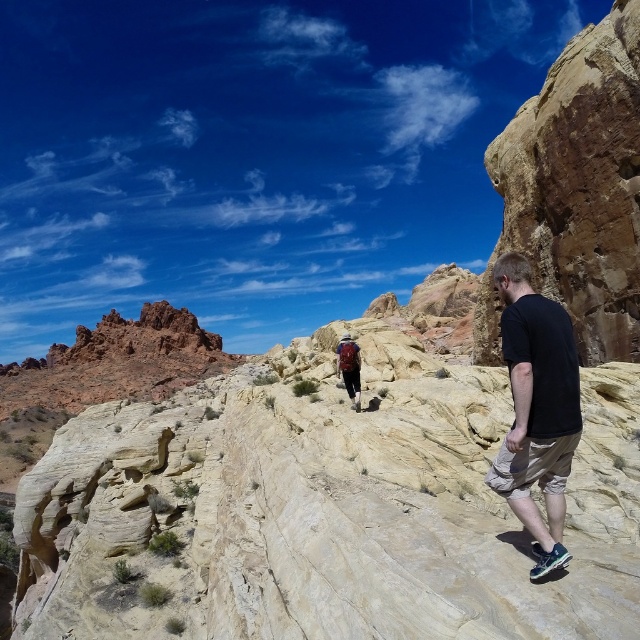
What do you see at coordinates (536, 408) in the screenshot? The height and width of the screenshot is (640, 640). I see `black cotton t-shirt at right` at bounding box center [536, 408].

Can you confirm if black cotton t-shirt at right is wider than matte brown backpack at center?

Indeed, black cotton t-shirt at right has a greater width compared to matte brown backpack at center.

This screenshot has width=640, height=640. In order to click on black cotton t-shirt at right in this screenshot , I will do `click(536, 408)`.